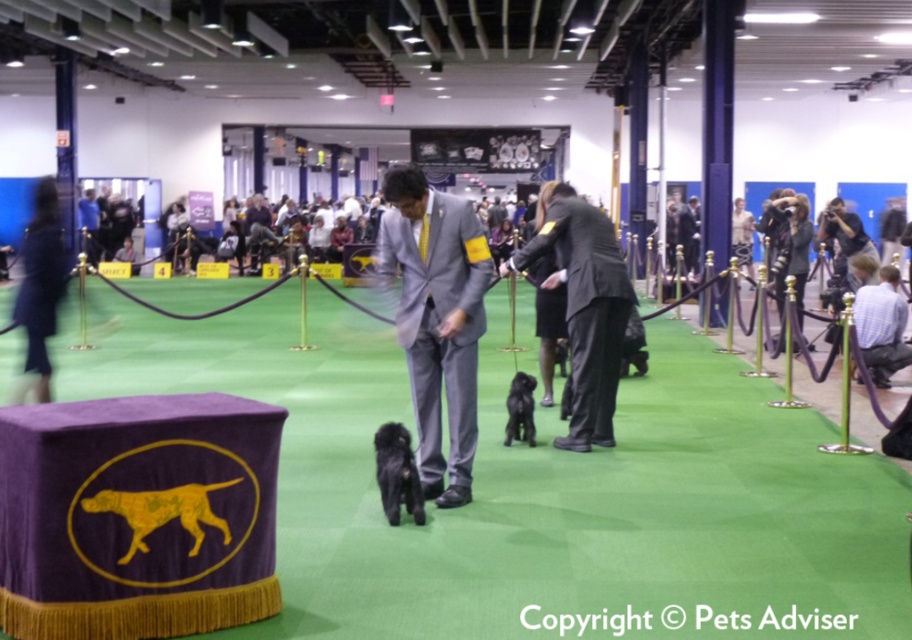
Question: Which point appears closest to the camera in this image?

Choices:
 (A) (475, 301)
 (B) (575, 381)

Answer: (A)

Question: Does gray suit at center have a smaller size compared to dark gray suit at center?

Choices:
 (A) no
 (B) yes

Answer: (B)

Question: Which object is farther from the camera taking this photo?

Choices:
 (A) dark gray suit at center
 (B) black silky dog at center
 (C) gray suit at center
 (D) white shirt at lower right

Answer: (D)

Question: Estimate the real-world distances between objects in this image. Which object is farther from the dark gray suit at center?

Choices:
 (A) black silky dog at center
 (B) gray suit at center
 (C) white shirt at lower right
 (D) black fuzzy dog at center

Answer: (C)

Question: Can you confirm if dark gray suit at center is bigger than black fuzzy dog at center?

Choices:
 (A) no
 (B) yes

Answer: (B)

Question: Can you confirm if dark gray suit at center is wider than black fuzzy dog at center?

Choices:
 (A) yes
 (B) no

Answer: (A)